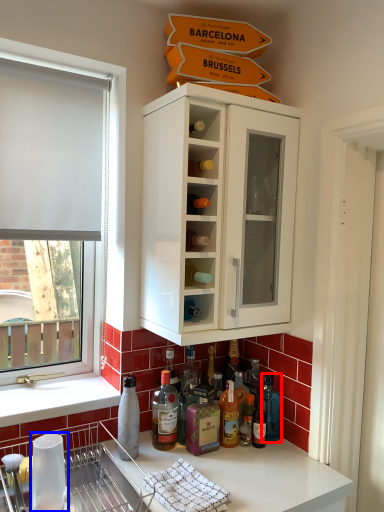
Question: Which of the following is the farthest to the observer, bottle (highlighted by a red box) or appliance (highlighted by a blue box)?

Choices:
 (A) bottle
 (B) appliance

Answer: (A)